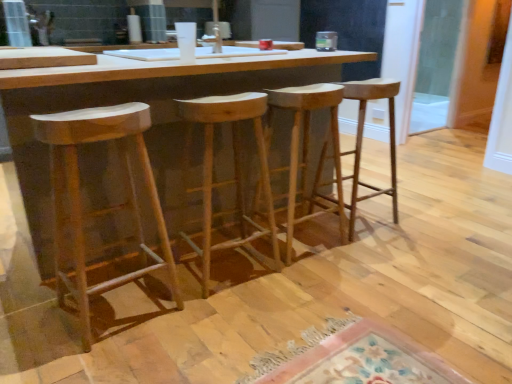
I want to click on spots to the right of natural wood stool at center, acting as the fourth stool starting from the left, so click(x=399, y=223).